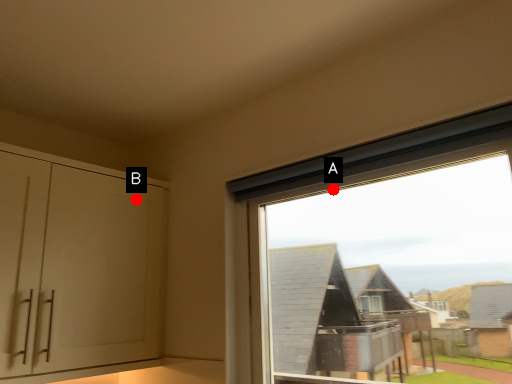
Question: Two points are circled on the image, labeled by A and B beside each circle. Among these points, which one is farthest from the camera?

Choices:
 (A) A is further
 (B) B is further

Answer: (B)